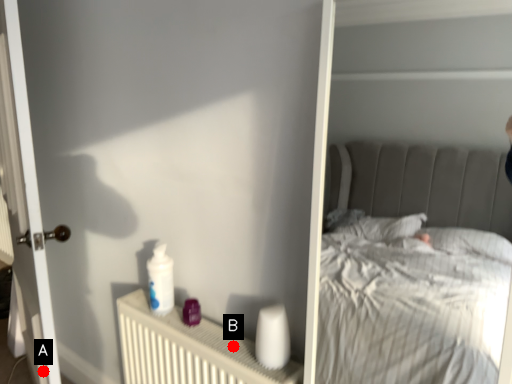
Question: Two points are circled on the image, labeled by A and B beside each circle. Which of the following is the farthest from the observer?

Choices:
 (A) A is further
 (B) B is further

Answer: (A)